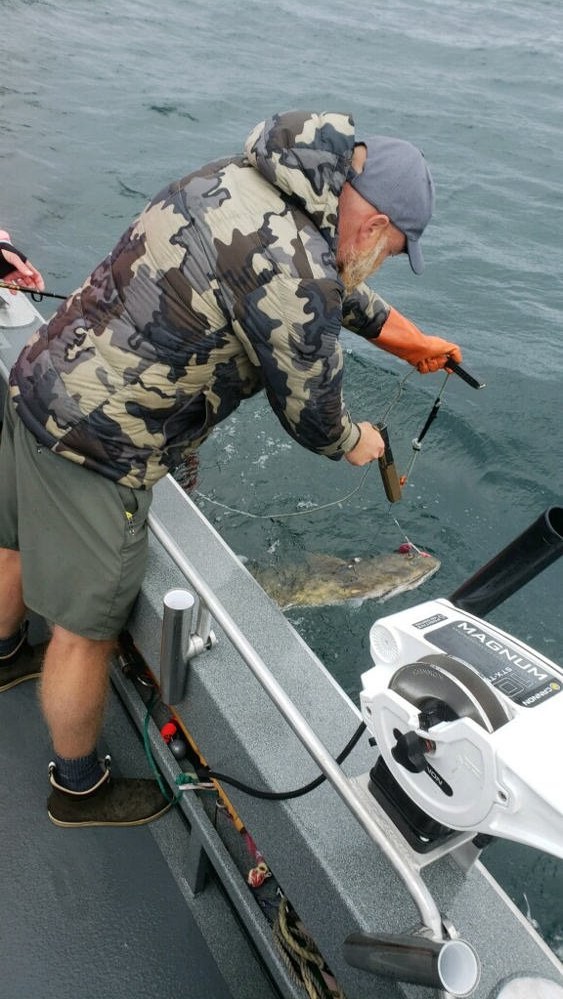
The width and height of the screenshot is (563, 999). Find the location of `storage area`. storage area is located at coordinates (239, 855).